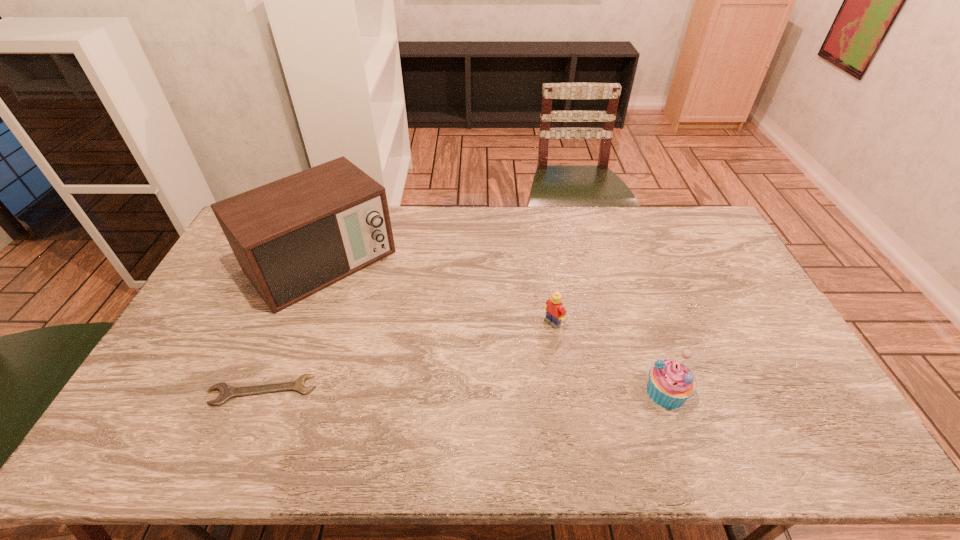
At what (x,y) coordinates should I click in order to perform the action: click on free location located on the front-facing side of the second object from right to left. Please return your answer as a coordinate pair (x, y). Looking at the image, I should click on (507, 358).

Locate an element on the screen. The height and width of the screenshot is (540, 960). free location located 0.140m on the front-facing side of the second object from right to left is located at coordinates (513, 354).

Find the location of a particular element. The width and height of the screenshot is (960, 540). object located at the far edge is located at coordinates (293, 237).

Identify the location of wrench present at the near edge. (227, 391).

Find the location of a particular element. This screenshot has height=540, width=960. muffin that is positioned at the near edge is located at coordinates (670, 384).

This screenshot has height=540, width=960. I want to click on object positioned at the left edge, so click(x=293, y=237).

Locate an element on the screen. Image resolution: width=960 pixels, height=540 pixels. object at the far left corner is located at coordinates click(x=293, y=237).

Where is `free space at the far edge`? This screenshot has height=540, width=960. free space at the far edge is located at coordinates (572, 220).

This screenshot has width=960, height=540. Find the location of `vacant space at the near edge`. vacant space at the near edge is located at coordinates pos(335,399).

Where is `vacant space at the left edge`? The height and width of the screenshot is (540, 960). vacant space at the left edge is located at coordinates (163, 382).